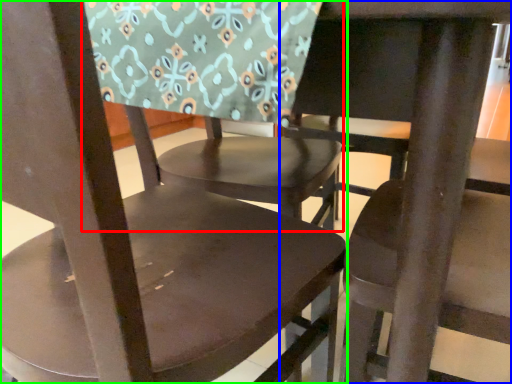
Question: Based on their relative distances, which object is nearer to chair (highlighted by a red box)? Choose from chair (highlighted by a blue box) and chair (highlighted by a green box).

Choices:
 (A) chair
 (B) chair

Answer: (B)